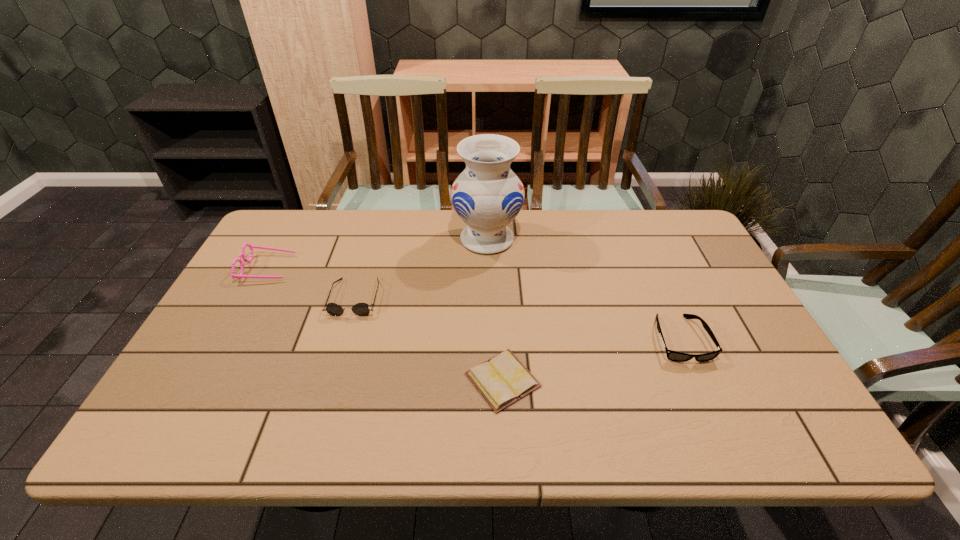
You are a GUI agent. You are given a task and a screenshot of the screen. Output one action in this format:
    pyautogui.click(x=<x>, y=<y>)
    Task: Click on the blank space located 0.300m on the left of the diary
    
    Given the screenshot: What is the action you would take?
    pyautogui.click(x=336, y=380)

Where is `object present at the far edge`? The height and width of the screenshot is (540, 960). object present at the far edge is located at coordinates (487, 196).

Locate an element on the screen. The image size is (960, 540). object at the near edge is located at coordinates (502, 380).

The width and height of the screenshot is (960, 540). Find the location of `object that is at the left edge`. object that is at the left edge is located at coordinates (242, 254).

You are a GUI agent. You are given a task and a screenshot of the screen. Output one action in this format:
    pyautogui.click(x=<x>, y=<y>)
    Task: Click on the object located at the right edge
    The width and height of the screenshot is (960, 540).
    Given the screenshot: What is the action you would take?
    pyautogui.click(x=671, y=355)

The width and height of the screenshot is (960, 540). In the image, there is a desktop. Find the location of `free space at the far edge`. free space at the far edge is located at coordinates (531, 224).

In order to click on free location at the near edge of the desktop in this screenshot , I will do `click(372, 436)`.

I want to click on vacant space at the left edge of the desktop, so click(254, 355).

Locate an element on the screen. Image resolution: width=960 pixels, height=540 pixels. free location at the right edge of the desktop is located at coordinates (721, 304).

You are a GUI agent. You are given a task and a screenshot of the screen. Output one action in this format:
    pyautogui.click(x=<x>, y=<y>)
    Task: Click on the free region at the far left corner of the desktop
    The image size is (960, 540).
    Given the screenshot: What is the action you would take?
    pyautogui.click(x=298, y=226)